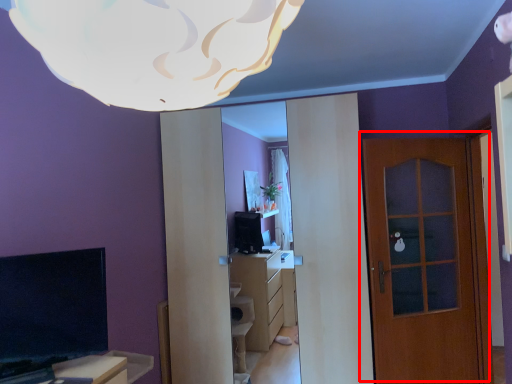
Question: Observing the image, what is the correct spatial positioning of door (annotated by the red box) in reference to lamp?

Choices:
 (A) right
 (B) left

Answer: (A)